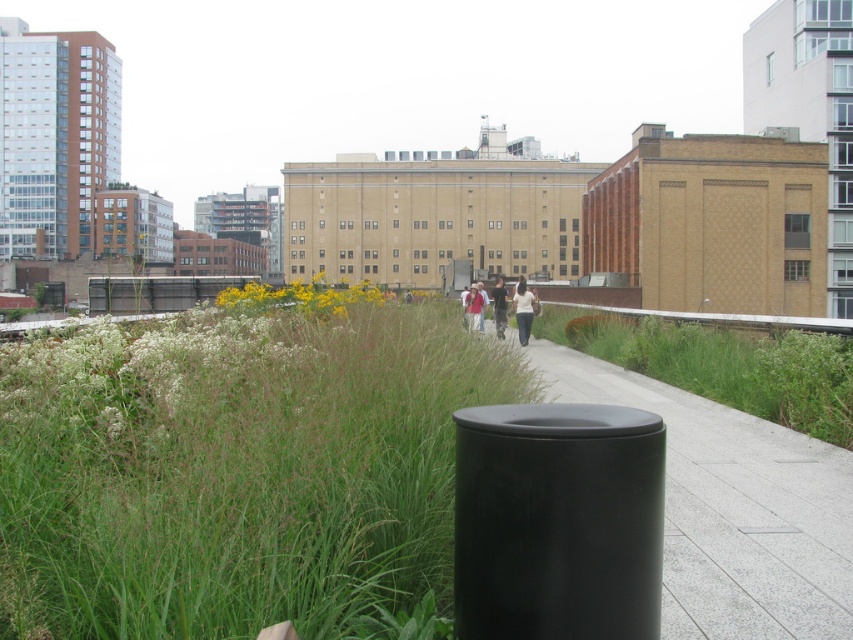
Is green grass at center to the left of black concrete pavement at center from the viewer's perspective?

Indeed, green grass at center is positioned on the left side of black concrete pavement at center.

Can you confirm if green grass at center is positioned above black concrete pavement at center?

Correct, green grass at center is located above black concrete pavement at center.

Is point (170, 436) in front of point (830, 618)?

Yes.

This screenshot has height=640, width=853. What are the coordinates of `green grass at center` in the screenshot? It's located at (235, 472).

Does black concrete pavement at center appear on the right side of yellow-green flowers at center?

Yes, black concrete pavement at center is to the right of yellow-green flowers at center.

You are a GUI agent. You are given a task and a screenshot of the screen. Output one action in this format:
    pyautogui.click(x=<x>, y=<y>)
    Task: Click on the black concrete pavement at center
    
    Given the screenshot: What is the action you would take?
    pyautogui.click(x=732, y=508)

Which is behind, point (666, 540) or point (349, 296)?

The point (349, 296) is behind.

I want to click on black concrete pavement at center, so click(732, 508).

Does white matte jacket at center have a larger size compared to dark blue shirt at center?

Yes.

Is point (524, 340) positioned behind point (495, 296)?

That is False.

Is point (515, 323) in front of point (503, 321)?

No, (515, 323) is further to viewer.

You are a GUI agent. You are given a task and a screenshot of the screen. Output one action in this format:
    pyautogui.click(x=<x>, y=<y>)
    Task: Click on the white matte jacket at center
    
    Given the screenshot: What is the action you would take?
    pyautogui.click(x=523, y=308)